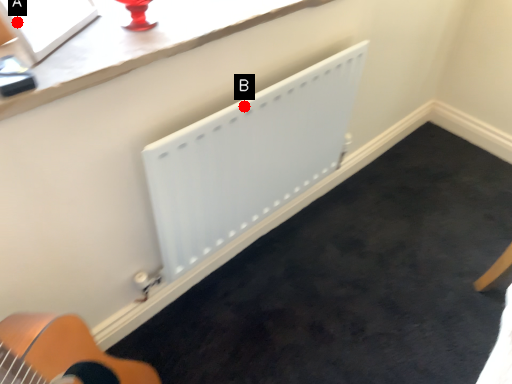
Question: Two points are circled on the image, labeled by A and B beside each circle. Which point is further to the camera?

Choices:
 (A) A is further
 (B) B is further

Answer: (B)